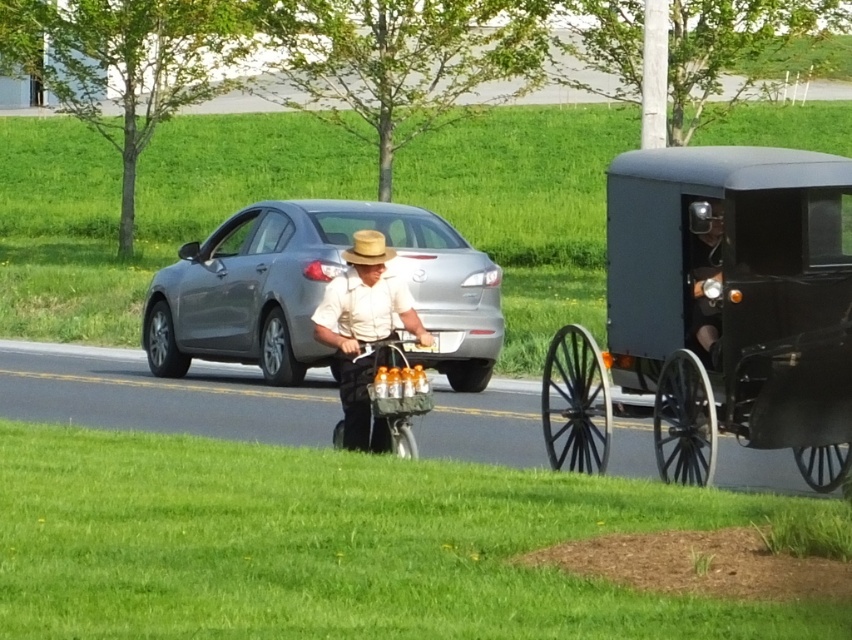
You are a delivery driver who needs to choose between the silver metallic sedan at center and the matte black buggy at right for a trip to a nearby town. Based on their sizes, which vehicle would be more suitable for carrying a large package?

The silver metallic sedan at center is larger in size than the matte black buggy at right, so it would be more suitable for carrying a large package.

You are a delivery person who needs to choose between the black wood wagon at right and the silver metallic sedan at center for transporting a large package. Which vehicle should you choose based on their heights?

The black wood wagon at right is taller than the silver metallic sedan at center, so you should choose the black wood wagon at right for transporting the large package as it has more vertical space.